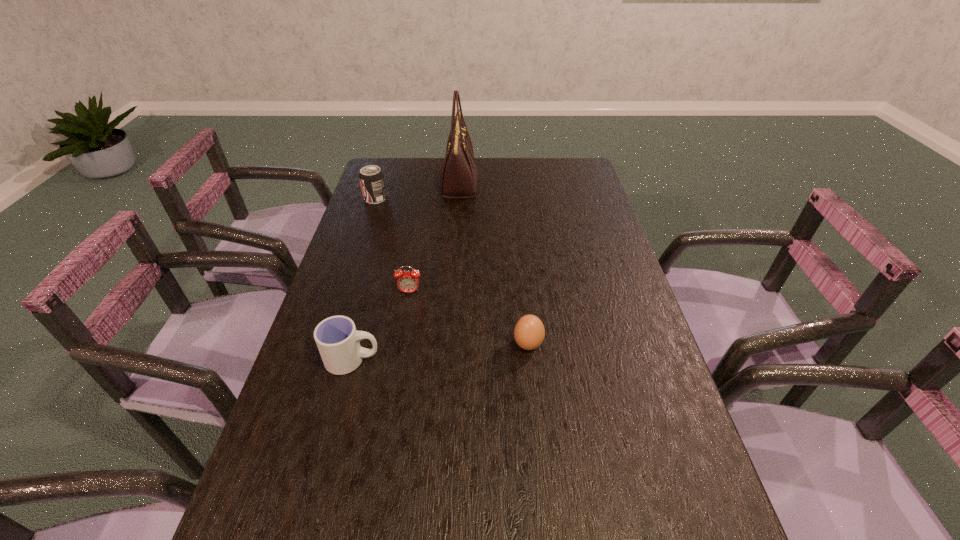
Find the location of a particular element. The height and width of the screenshot is (540, 960). vacant space that satisfies the following two spatial constraints: 1. on the face of the third object from left to right; 2. with the handle on the side of the cup is located at coordinates (398, 360).